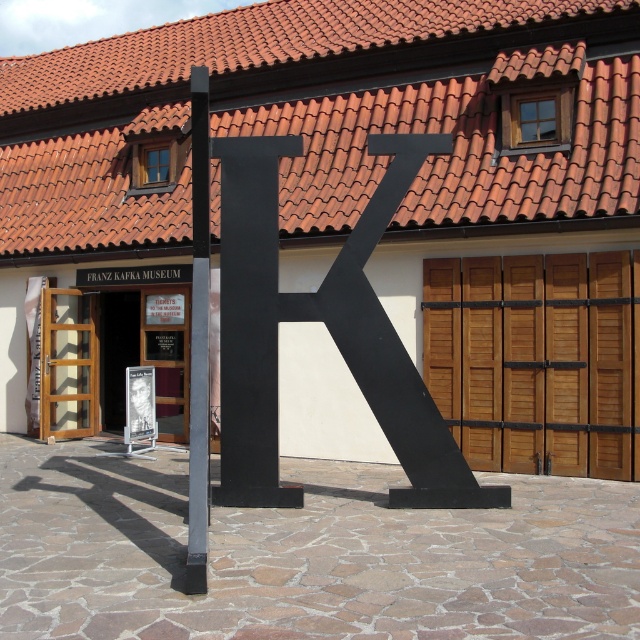
Question: Which point is closer to the camera?

Choices:
 (A) wooden at center
 (B) red clay tiles at upper center
 (C) black matte letter k at center

Answer: (C)

Question: Considering the real-world distances, which object is farthest from the metallic gray pole at center?

Choices:
 (A) wooden at center
 (B) red clay tiles at upper center

Answer: (B)

Question: Is black matte letter k at center to the left of metallic gray pole at center from the viewer's perspective?

Choices:
 (A) yes
 (B) no

Answer: (B)

Question: Which of these objects is positioned closest to the black matte letter k at center?

Choices:
 (A) metallic gray pole at center
 (B) red clay tiles at upper center

Answer: (A)

Question: From the image, what is the correct spatial relationship of red clay tiles at upper center in relation to wooden at center?

Choices:
 (A) left
 (B) right

Answer: (A)

Question: Is black matte letter k at center positioned at the back of wooden at center?

Choices:
 (A) yes
 (B) no

Answer: (B)